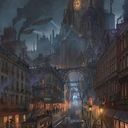
Identify the location of chimney. This screenshot has height=128, width=128. (37, 37), (50, 37), (53, 34).